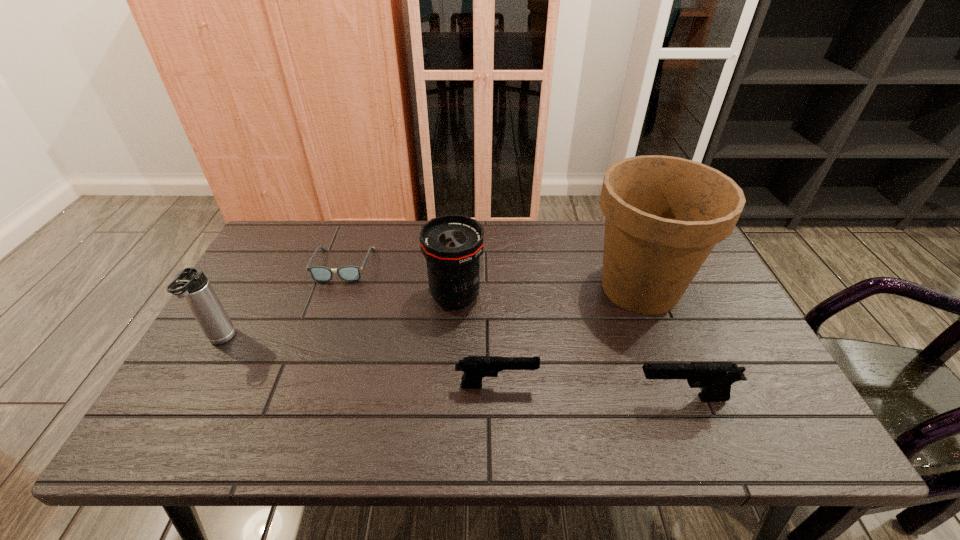
You are a GUI agent. You are given a task and a screenshot of the screen. Output one action in this format:
    pyautogui.click(x=<x>, y=<y>)
    Task: Click on the vacant region located 0.360m on the front-facing side of the taller pistol
    The height and width of the screenshot is (540, 960).
    Given the screenshot: What is the action you would take?
    pyautogui.click(x=475, y=398)

This screenshot has height=540, width=960. I want to click on free location located 0.110m on the front-facing side of the taller pistol, so click(585, 398).

Locate an element on the screen. Image resolution: width=960 pixels, height=540 pixels. vacant region located 0.170m on the front-facing side of the taller pistol is located at coordinates (x=559, y=398).

Where is `vacant space located on the face of the second object from left to right`? Image resolution: width=960 pixels, height=540 pixels. vacant space located on the face of the second object from left to right is located at coordinates (325, 315).

This screenshot has width=960, height=540. I want to click on free space located 0.370m on the right of the telephoto lens, so click(x=613, y=296).

Image resolution: width=960 pixels, height=540 pixels. I want to click on free point located 0.210m on the left of the flowerpot, so click(512, 288).

Where is `free region located on the handle side of the thermos bottle`? This screenshot has width=960, height=540. free region located on the handle side of the thermos bottle is located at coordinates (185, 402).

In order to click on spectacles located at the far edge in this screenshot , I will do `click(319, 273)`.

Where is `flowerpot located at the far edge`? The height and width of the screenshot is (540, 960). flowerpot located at the far edge is located at coordinates (663, 215).

The image size is (960, 540). What are the coordinates of `object that is at the left edge` in the screenshot? It's located at (191, 283).